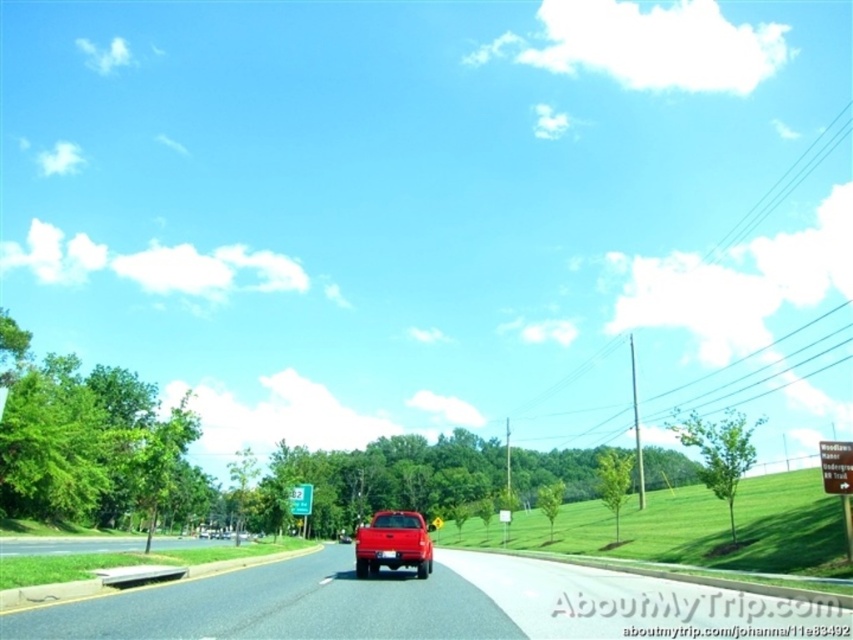
Looking at this image, you are a delivery driver who needs to pass under the power lines along the road. The power lines are exactly at the same height as the green plastic sign at center. Will the glossy red truck at center be able to pass under them without hitting the power lines?

The glossy red truck at center has a lesser height compared to green plastic sign at center, which is the same height as the power lines. Therefore, the truck can pass under the power lines safely without hitting them.

Consider the image. You are a drone operator trying to capture aerial footage of the matte red truck at center and the gray asphalt road at lower left. Since the drone has a limited battery, you need to prioritize filming the taller object first. Which object should you film first?

The gray asphalt road at lower left is taller than the matte red truck at center, so you should film the gray asphalt road at lower left first.

You are a photographer planning to take a wide shot of the matte red truck at center and the gray asphalt road at lower left. Based on their sizes in the image, which object would appear more prominent in the photo?

The gray asphalt road at lower left appears larger than the matte red truck at center, so it would be more prominent in the photo.